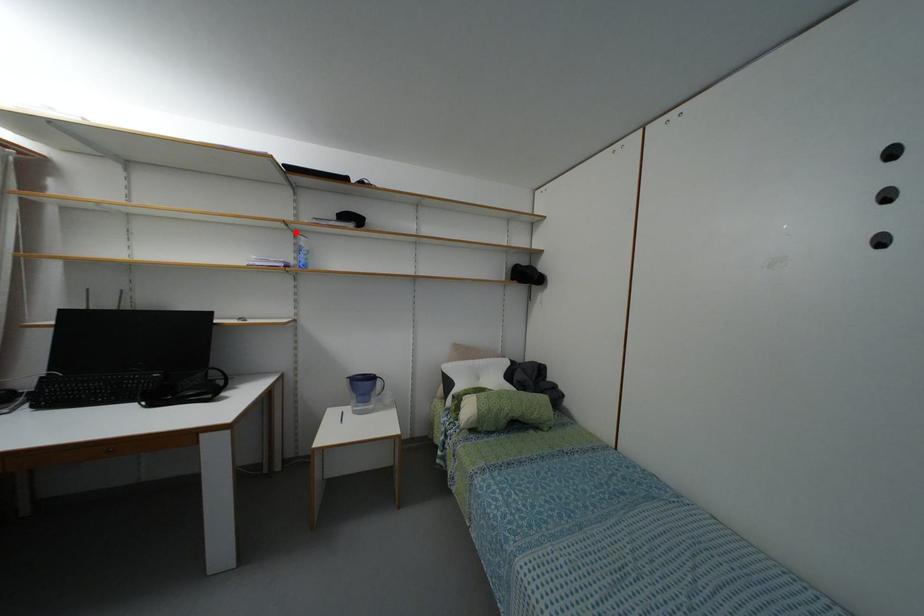
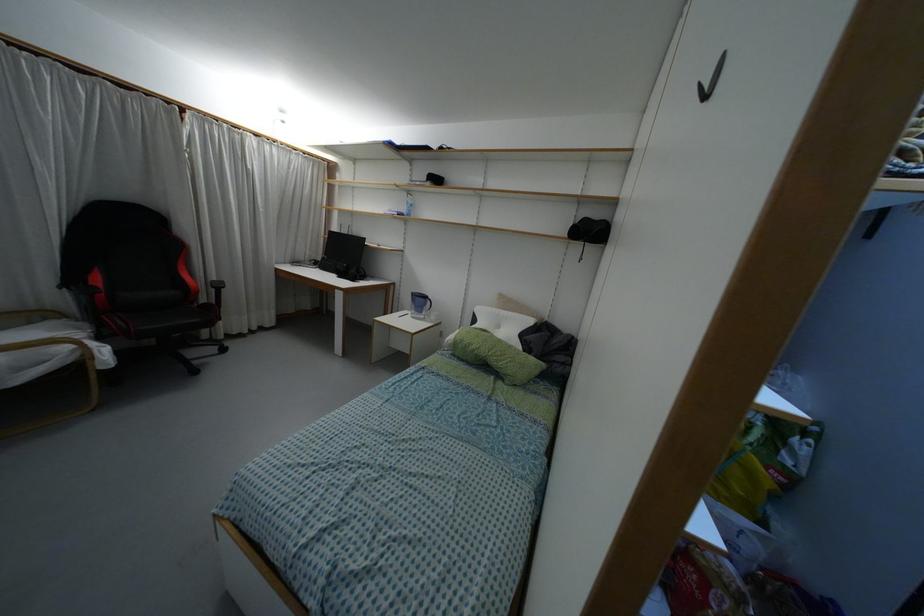
Locate, in the second image, the point that corresponds to the highlighted location in the first image.

(407, 192)